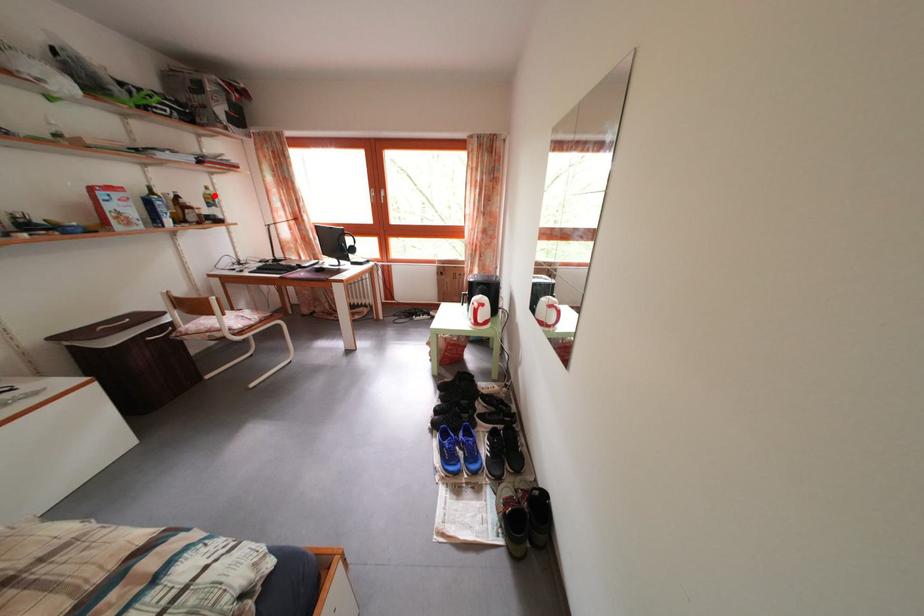
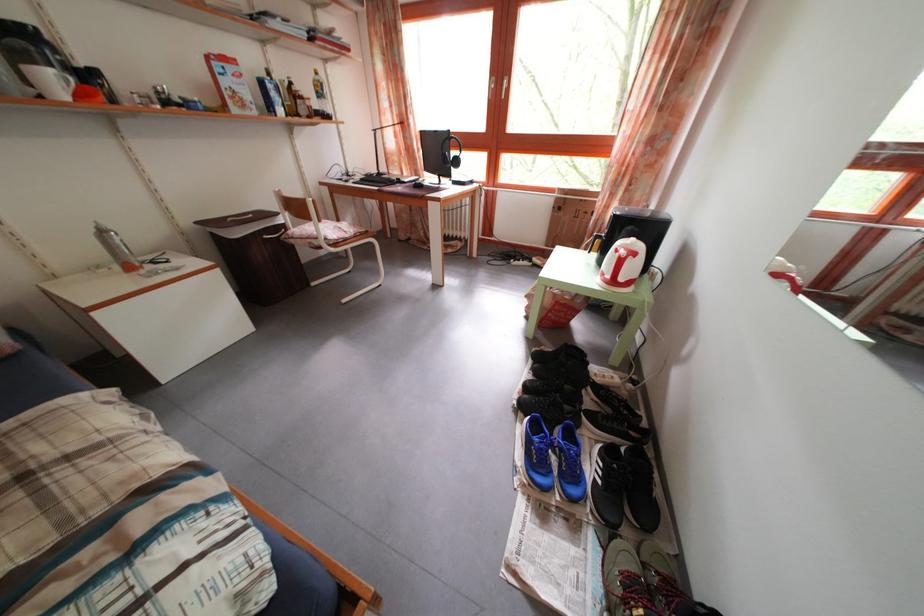
Find the pixel in the second image that matches the highlighted location in the first image.

(323, 79)